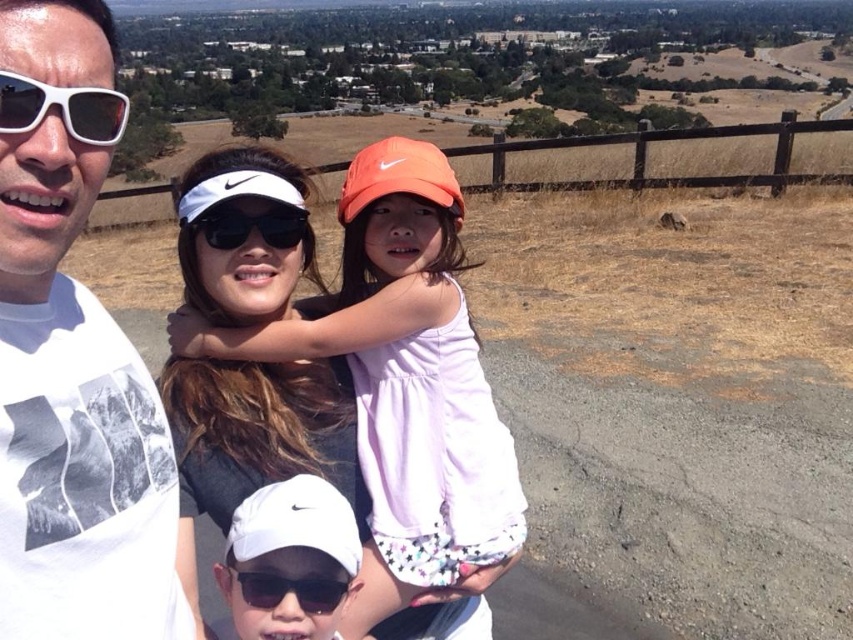
You are a photographer setting up a camera. You notice the white cotton dress at center and the black plastic sunglasses at lower center in the scene. Which object should you focus on if you want to capture the wider object in your shot?

The white cotton dress at center is wider than the black plastic sunglasses at lower center, so you should focus on the white cotton dress at center to capture the wider object.